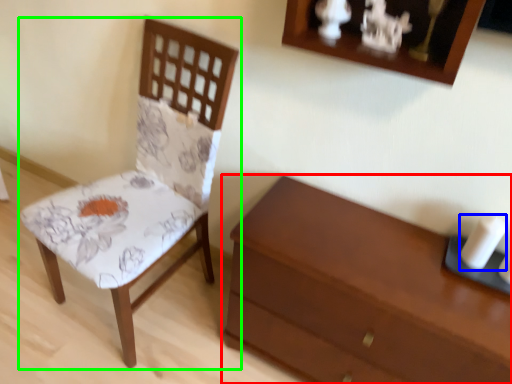
Question: Estimate the real-world distances between objects in this image. Which object is closer to chest of drawers (highlighted by a red box), candle (highlighted by a blue box) or chair (highlighted by a green box)?

Choices:
 (A) candle
 (B) chair

Answer: (A)